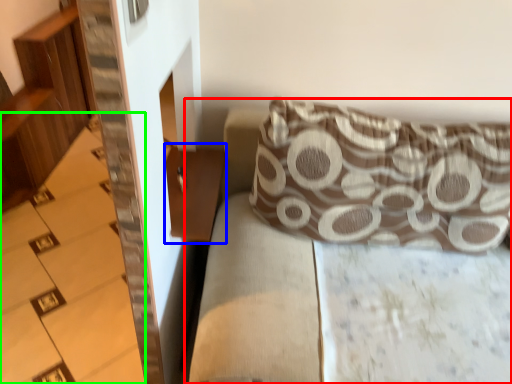
Question: Which object is positioned farthest from couch (highlighted by a red box)? Select from table (highlighted by a blue box) and stairwell (highlighted by a green box).

Choices:
 (A) table
 (B) stairwell

Answer: (B)